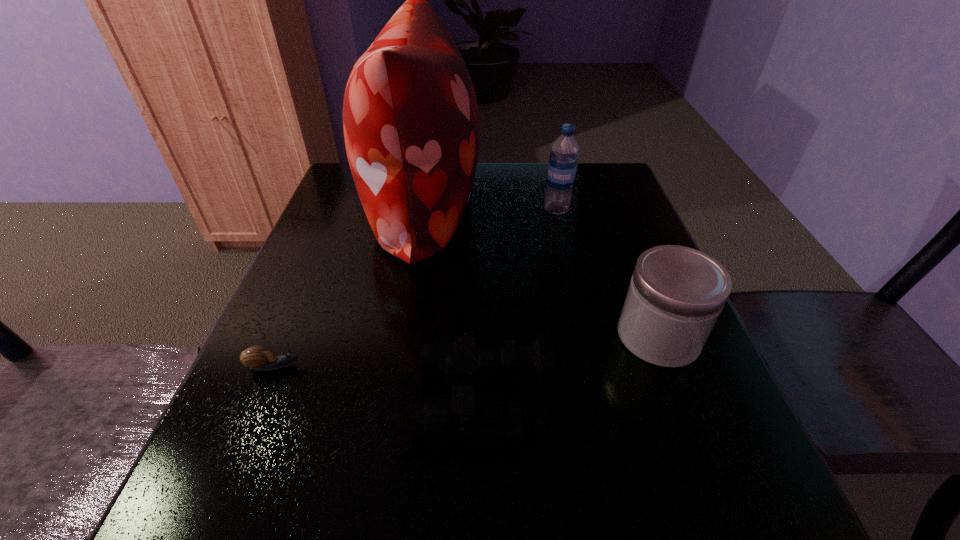
The image size is (960, 540). I want to click on escargot located at the left edge, so click(x=257, y=358).

I want to click on object that is at the right edge, so click(676, 294).

Where is `object at the far left corner`? object at the far left corner is located at coordinates (410, 118).

Find the location of a particular element. vacant region at the far edge of the desktop is located at coordinates (518, 161).

Find the location of a particular element. This screenshot has width=960, height=540. vacant region at the near edge of the desktop is located at coordinates (558, 472).

I want to click on free space at the left edge, so click(347, 263).

Where is `vacant region at the right edge of the desktop`? The image size is (960, 540). vacant region at the right edge of the desktop is located at coordinates pos(728,443).

Locate an element on the screen. The width and height of the screenshot is (960, 540). free space at the far left corner of the desktop is located at coordinates [x=336, y=204].

Locate an element on the screen. free space between the water bottle and the tallest object is located at coordinates (490, 209).

I want to click on free space between the tallest object and the fourth shortest object, so click(490, 209).